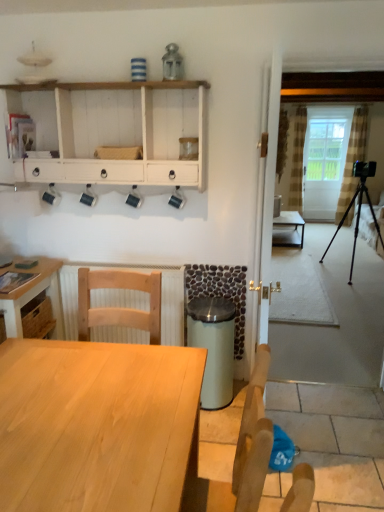
The image size is (384, 512). Describe the element at coordinates (356, 222) in the screenshot. I see `black metal tripod at right` at that location.

In order to face light wood table at lower left, placed as the 1th table when sorted from bottom to top, should I rotate leftwards or rightwards?

Turn left by 15.708 degrees to look at light wood table at lower left, placed as the 1th table when sorted from bottom to top.

The width and height of the screenshot is (384, 512). What do you see at coordinates (96, 425) in the screenshot?
I see `light wood table at lower left, marked as the second table in a right-to-left arrangement` at bounding box center [96, 425].

This screenshot has width=384, height=512. Describe the element at coordinates (288, 230) in the screenshot. I see `matte black table at center, placed as the 3th table when sorted from bottom to top` at that location.

Where is `black metal tripod at right`? black metal tripod at right is located at coordinates (356, 222).

Is white wood shelf at upper left looking in the opposite direction of light wood chair at lower left?

No, white wood shelf at upper left's orientation is not away from light wood chair at lower left.

From a real-world perspective, is white wood shelf at upper left physically located above or below light wood chair at lower left?

From a real-world perspective, white wood shelf at upper left is physically above light wood chair at lower left.

Are white wood shelf at upper left and light wood chair at lower left located far from each other?

No, white wood shelf at upper left is not far away from light wood chair at lower left.

Who is bigger, white wood shelf at upper left or light wood chair at lower left?

white wood shelf at upper left.

Would you say light wood chair at lower left contains light wood table at lower left, marked as the second table in a right-to-left arrangement?

No, light wood table at lower left, marked as the second table in a right-to-left arrangement, is not a part of light wood chair at lower left.

In the scene shown: Is light wood chair at lower left taller or shorter than light wood table at lower left, the 1th table positioned from the front?

light wood chair at lower left is shorter than light wood table at lower left, the 1th table positioned from the front.

From a real-world perspective, does light wood chair at lower left sit lower than light wood table at lower left, the 1th table positioned from the front?

No, from a real-world perspective, light wood chair at lower left is not under light wood table at lower left, the 1th table positioned from the front.

Which is more to the right, light wood chair at lower left or light wood table at lower left, which is the 3th table in back-to-front order?

light wood table at lower left, which is the 3th table in back-to-front order, is more to the right.

Is point (14, 269) farther from camera compared to point (194, 125)?

Yes, it is.

Is light wood table at lower left, the second table positioned from the back, positioned beyond the bounds of white wood shelf at upper left?

Absolutely, light wood table at lower left, the second table positioned from the back, is external to white wood shelf at upper left.

Is white wood shelf at upper left at the back of light wood table at lower left, which is the 2th table from front to back?

No.

Which of these two, white glass screen door at center or light wood table at lower left, which is counted as the third table, starting from the right, is bigger?

With larger size is light wood table at lower left, which is counted as the third table, starting from the right.

From the image's perspective, between white glass screen door at center and light wood table at lower left, which is the 2th table from front to back, who is located below?

From the image's view, light wood table at lower left, which is the 2th table from front to back, is below.

Considering the relative positions of white glass screen door at center and light wood table at lower left, which is counted as the third table, starting from the right, in the image provided, is white glass screen door at center to the left of light wood table at lower left, which is counted as the third table, starting from the right, from the viewer's perspective?

No.

Is light wood table at lower left, which is the first table from left to right, a part of white glass screen door at center?

No, light wood table at lower left, which is the first table from left to right, is located outside of white glass screen door at center.

Does matte black table at center, which is counted as the 1th table, starting from the right, touch white wood shelf at upper left?

No, matte black table at center, which is counted as the 1th table, starting from the right, is not beside white wood shelf at upper left.

From a real-world perspective, is matte black table at center, the 1th table positioned from the back, on top of white wood shelf at upper left?

No, from a real-world perspective, matte black table at center, the 1th table positioned from the back, is not above white wood shelf at upper left.

Relative to light wood table at lower left, the second table in the top-to-bottom sequence, is white wood shelf at upper left in front or behind?

white wood shelf at upper left is positioned farther from the viewer than light wood table at lower left, the second table in the top-to-bottom sequence.

Could you tell me if white wood shelf at upper left is turned towards light wood table at lower left, which is counted as the third table, starting from the right?

No, white wood shelf at upper left does not turn towards light wood table at lower left, which is counted as the third table, starting from the right.

Is point (16, 172) closer or farther from the camera than point (14, 259)?

Clearly, point (16, 172) is closer to the camera than point (14, 259).

From the image's perspective, which is below, white wood shelf at upper left or light wood table at lower left, which is counted as the third table, starting from the right?

light wood table at lower left, which is counted as the third table, starting from the right, is shown below in the image.

How different are the orientations of black metal tripod at right and light wood chair at lower left in degrees?

They differ by 7.2 degrees in their facing directions.

Can you confirm if black metal tripod at right is smaller than light wood chair at lower left?

Incorrect, black metal tripod at right is not smaller in size than light wood chair at lower left.

You are a GUI agent. You are given a task and a screenshot of the screen. Output one action in this format:
    pyautogui.click(x=<x>, y=<y>)
    Task: Click on the tripod that is above the light wood chair at lower left (from the image's perspective)
    This screenshot has width=384, height=512.
    Given the screenshot: What is the action you would take?
    pyautogui.click(x=356, y=222)

Is black metal tripod at right to the left or to the right of light wood chair at lower left in the image?

Clearly, black metal tripod at right is on the right of light wood chair at lower left in the image.

At what (x,y) coordinates should I click in order to perform the action: click on chair that is behind the white wood shelf at upper left. Please return your answer as a coordinate pair (x, y). Image resolution: width=384 pixels, height=512 pixels. Looking at the image, I should click on (120, 307).

From the light wood chair at lower left, count 2nd tables forward and point to it. Please provide its 2D coordinates.

[(96, 425)]

From the image, which object appears to be nearer to matte black table at center, which is counted as the 1th table, starting from the right, light wood chair at lower left or light wood table at lower left, the second table in the top-to-bottom sequence?

light wood table at lower left, the second table in the top-to-bottom sequence.

Considering their positions, is light wood table at lower left, marked as the second table in a right-to-left arrangement, positioned closer to light wood table at lower left, the second table when ordered from bottom to top, than white glass screen door at center?

light wood table at lower left, marked as the second table in a right-to-left arrangement, is positioned closer to the anchor light wood table at lower left, the second table when ordered from bottom to top.

Based on their spatial positions, is light wood table at lower left, which is the 3th table in back-to-front order, or light wood chair at lower left closer to white glass screen door at center?

The object closer to white glass screen door at center is light wood chair at lower left.

Estimate the real-world distances between objects in this image. Which object is further from white glass screen door at center, light wood table at lower left, placed as the 1th table when sorted from bottom to top, or white wood shelf at upper left?

Based on the image, light wood table at lower left, placed as the 1th table when sorted from bottom to top, appears to be further to white glass screen door at center.

Based on their spatial positions, is white glass screen door at center or black metal tripod at right closer to light wood table at lower left, marked as the second table in a right-to-left arrangement?

black metal tripod at right.

Which object lies nearer to the anchor point white glass screen door at center, light wood table at lower left, which is the 2th table from front to back, or light wood chair at lower left?

light wood table at lower left, which is the 2th table from front to back.

Looking at the image, which one is located closer to light wood table at lower left, which ranks as the 3th table in top-to-bottom order, light wood table at lower left, the second table when ordered from bottom to top, or white glass screen door at center?

Based on the image, light wood table at lower left, the second table when ordered from bottom to top, appears to be nearer to light wood table at lower left, which ranks as the 3th table in top-to-bottom order.

In the scene shown: Estimate the real-world distances between objects in this image. Which object is closer to white wood shelf at upper left, black metal tripod at right or light wood table at lower left, which is the 3th table in back-to-front order?

The object closer to white wood shelf at upper left is light wood table at lower left, which is the 3th table in back-to-front order.

Identify the location of chair between light wood table at lower left, the 2th table when ordered from left to right, and black metal tripod at right from front to back. Image resolution: width=384 pixels, height=512 pixels. (120, 307).

Locate an element on the screen. The width and height of the screenshot is (384, 512). table positioned between light wood table at lower left, which is the first table from left to right, and white glass screen door at center from near to far is located at coordinates (288, 230).

Locate an element on the screen. shelf located between light wood table at lower left, placed as the 1th table when sorted from bottom to top, and white glass screen door at center in the depth direction is located at coordinates tap(115, 131).

Locate an element on the screen. The width and height of the screenshot is (384, 512). chair located between light wood table at lower left, the second table positioned from the back, and matte black table at center, the 1th table positioned from the back, in the depth direction is located at coordinates (120, 307).